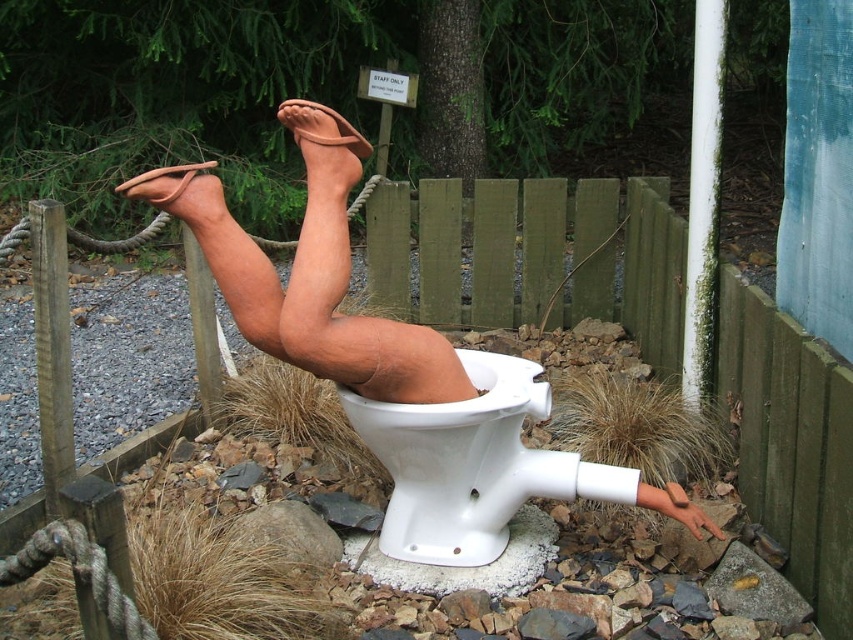
Question: Which is farther from the matte clay legs at center?

Choices:
 (A) brown matte sandal at upper center
 (B) white glossy toilet bowl at center

Answer: (A)

Question: Estimate the real-world distances between objects in this image. Which object is farther from the white glossy toilet bowl at center?

Choices:
 (A) brown leather sandal at upper center
 (B) matte clay legs at center
 (C) brown matte sandal at upper center

Answer: (A)

Question: Is matte clay legs at center positioned in front of brown matte sandal at upper center?

Choices:
 (A) no
 (B) yes

Answer: (B)

Question: Considering the relative positions of white glossy toilet bowl at center and brown leather sandal at upper center in the image provided, where is white glossy toilet bowl at center located with respect to brown leather sandal at upper center?

Choices:
 (A) right
 (B) left

Answer: (A)

Question: Which of these objects is positioned farthest from the matte clay legs at center?

Choices:
 (A) white glossy toilet bowl at center
 (B) brown matte sandal at upper center
 (C) brown leather sandal at upper center

Answer: (C)

Question: Is matte clay legs at center closer to camera compared to white glossy toilet bowl at center?

Choices:
 (A) yes
 (B) no

Answer: (A)